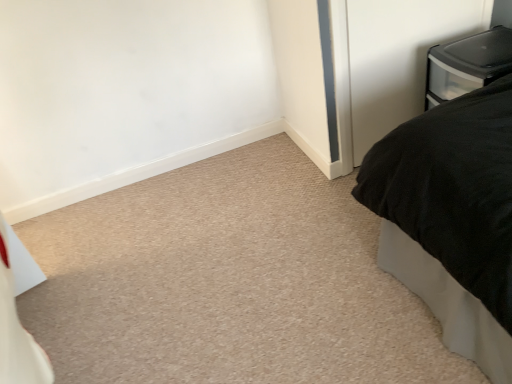
Question: From the image's perspective, does clear plastic drawer at upper right appear higher than clear plastic storage container at upper right?

Choices:
 (A) yes
 (B) no

Answer: (A)

Question: From a real-world perspective, is clear plastic drawer at upper right on clear plastic storage container at upper right?

Choices:
 (A) no
 (B) yes

Answer: (A)

Question: Is clear plastic drawer at upper right touching clear plastic storage container at upper right?

Choices:
 (A) yes
 (B) no

Answer: (B)

Question: From a real-world perspective, is clear plastic drawer at upper right positioned under clear plastic storage container at upper right based on gravity?

Choices:
 (A) yes
 (B) no

Answer: (A)

Question: From the image's perspective, is clear plastic drawer at upper right under clear plastic storage container at upper right?

Choices:
 (A) yes
 (B) no

Answer: (B)

Question: Can you confirm if clear plastic drawer at upper right is smaller than clear plastic storage container at upper right?

Choices:
 (A) yes
 (B) no

Answer: (A)

Question: Considering the relative sizes of clear plastic drawer at upper right and black matte bed at right in the image provided, is clear plastic drawer at upper right smaller than black matte bed at right?

Choices:
 (A) yes
 (B) no

Answer: (A)

Question: Can you confirm if clear plastic drawer at upper right is shorter than black matte bed at right?

Choices:
 (A) yes
 (B) no

Answer: (B)

Question: Is clear plastic drawer at upper right thinner than black matte bed at right?

Choices:
 (A) no
 (B) yes

Answer: (B)

Question: Would you say clear plastic drawer at upper right contains black matte bed at right?

Choices:
 (A) no
 (B) yes

Answer: (A)

Question: From a real-world perspective, is clear plastic drawer at upper right beneath black matte bed at right?

Choices:
 (A) yes
 (B) no

Answer: (B)

Question: Considering the relative sizes of clear plastic drawer at upper right and black matte bed at right in the image provided, is clear plastic drawer at upper right wider than black matte bed at right?

Choices:
 (A) no
 (B) yes

Answer: (A)

Question: Is black matte bed at right to the left of clear plastic storage container at upper right from the viewer's perspective?

Choices:
 (A) no
 (B) yes

Answer: (B)